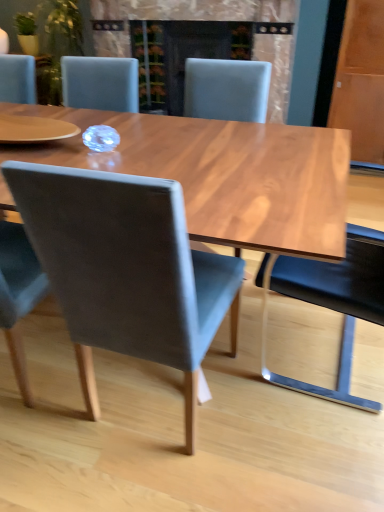
Locate an element on the screen. The image size is (384, 512). vacant area to the left of velvet grey chair at center, the second chair viewed from the left is located at coordinates (56, 422).